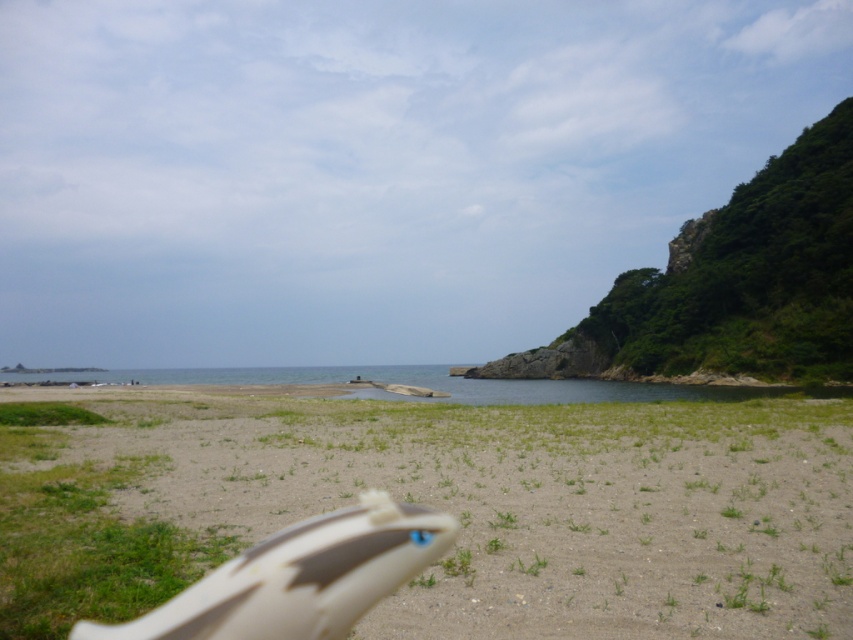
Question: Can you confirm if sandy beige at lower center is positioned to the left of clear blue water at center?

Choices:
 (A) no
 (B) yes

Answer: (A)

Question: Is sandy beige at lower center to the right of clear blue water at center from the viewer's perspective?

Choices:
 (A) no
 (B) yes

Answer: (B)

Question: Which point is farther to the camera?

Choices:
 (A) sandy beige at lower center
 (B) clear blue water at center

Answer: (B)

Question: Is the position of sandy beige at lower center less distant than that of clear blue water at center?

Choices:
 (A) yes
 (B) no

Answer: (A)